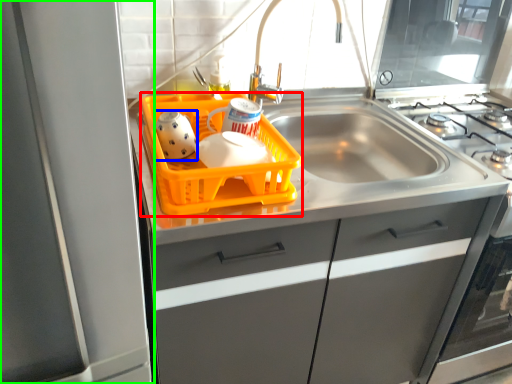
Question: Which object is the farthest from basket (highlighted by a red box)? Choose among these: tea pot (highlighted by a blue box) or appliance (highlighted by a green box).

Choices:
 (A) tea pot
 (B) appliance

Answer: (B)